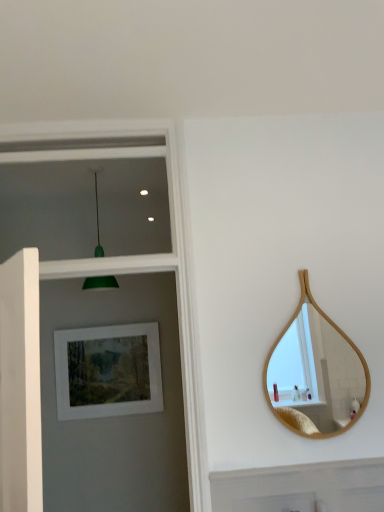
Describe the element at coordinates (108, 371) in the screenshot. I see `matte white picture frame at upper left` at that location.

Find the location of a particular element. This screenshot has height=512, width=384. bamboo mirror at right is located at coordinates (316, 373).

From a real-world perspective, which object stands above the other?

green matte pendant light at upper left, from a real-world perspective.

Is green matte pendant light at upper left not near bamboo mirror at right?

Yes, green matte pendant light at upper left and bamboo mirror at right are quite far apart.

Is green matte pendant light at upper left in front of or behind bamboo mirror at right in the image?

Clearly, green matte pendant light at upper left is behind bamboo mirror at right.

Where is `mirror that appears below the green matte pendant light at upper left (from a real-world perspective)`? The height and width of the screenshot is (512, 384). mirror that appears below the green matte pendant light at upper left (from a real-world perspective) is located at coordinates (316, 373).

Which of these two, matte white picture frame at upper left or green matte pendant light at upper left, is bigger?

green matte pendant light at upper left is bigger.

From a real-world perspective, who is located lower, matte white picture frame at upper left or green matte pendant light at upper left?

matte white picture frame at upper left.

Is matte white picture frame at upper left far away from green matte pendant light at upper left?

No, matte white picture frame at upper left is in close proximity to green matte pendant light at upper left.

You are a GUI agent. You are given a task and a screenshot of the screen. Output one action in this format:
    pyautogui.click(x=<x>, y=<y>)
    Task: Click on the light fixture lying above the matte white picture frame at upper left (from the image's perspective)
    This screenshot has height=512, width=384.
    Given the screenshot: What is the action you would take?
    pyautogui.click(x=100, y=283)

I want to click on picture frame on the right of green matte pendant light at upper left, so click(108, 371).

From a real-world perspective, is green matte pendant light at upper left above or below matte white picture frame at upper left?

green matte pendant light at upper left is situated higher than matte white picture frame at upper left in the real world.

Which of these two, green matte pendant light at upper left or matte white picture frame at upper left, is bigger?

green matte pendant light at upper left.

Which point is more forward, (299, 378) or (146, 379)?

Point (299, 378)

Which of these two, bamboo mirror at right or matte white picture frame at upper left, is smaller?

With smaller size is bamboo mirror at right.

Which is behind, bamboo mirror at right or matte white picture frame at upper left?

matte white picture frame at upper left is further from the camera.

Is bamboo mirror at right taller or shorter than matte white picture frame at upper left?

bamboo mirror at right is taller than matte white picture frame at upper left.

Who is shorter, matte white picture frame at upper left or bamboo mirror at right?

matte white picture frame at upper left.

Which is in front, matte white picture frame at upper left or bamboo mirror at right?

bamboo mirror at right is in front.

Consider the image. Would you say matte white picture frame at upper left is outside bamboo mirror at right?

Yes, matte white picture frame at upper left is outside of bamboo mirror at right.

Does matte white picture frame at upper left have a greater width compared to bamboo mirror at right?

Yes, matte white picture frame at upper left is wider than bamboo mirror at right.

From the image's perspective, is bamboo mirror at right below green matte pendant light at upper left?

Yes, from the image's perspective, bamboo mirror at right is beneath green matte pendant light at upper left.

Does bamboo mirror at right have a greater height compared to green matte pendant light at upper left?

Yes.

Could you tell me if bamboo mirror at right is turned towards green matte pendant light at upper left?

No, bamboo mirror at right is not oriented towards green matte pendant light at upper left.

Which object is positioned more to the right, bamboo mirror at right or green matte pendant light at upper left?

Positioned to the right is bamboo mirror at right.

Identify the location of light fixture on the left of bamboo mirror at right. (100, 283).

Image resolution: width=384 pixels, height=512 pixels. I want to click on picture frame below the green matte pendant light at upper left (from a real-world perspective), so click(x=108, y=371).

Considering their positions, is bamboo mirror at right positioned closer to matte white picture frame at upper left than green matte pendant light at upper left?

green matte pendant light at upper left lies closer to matte white picture frame at upper left than the other object.

Which object lies nearer to the anchor point matte white picture frame at upper left, green matte pendant light at upper left or bamboo mirror at right?

green matte pendant light at upper left is positioned closer to the anchor matte white picture frame at upper left.

Looking at the image, which one is located closer to bamboo mirror at right, matte white picture frame at upper left or green matte pendant light at upper left?

Among the two, matte white picture frame at upper left is located nearer to bamboo mirror at right.

When comparing their distances from green matte pendant light at upper left, does bamboo mirror at right or matte white picture frame at upper left seem further?

bamboo mirror at right.

From the image, which object appears to be farther from green matte pendant light at upper left, matte white picture frame at upper left or bamboo mirror at right?

bamboo mirror at right.

Estimate the real-world distances between objects in this image. Which object is closer to bamboo mirror at right, green matte pendant light at upper left or matte white picture frame at upper left?

matte white picture frame at upper left.

Where is `picture frame between green matte pendant light at upper left and bamboo mirror at right in the horizontal direction`? The width and height of the screenshot is (384, 512). picture frame between green matte pendant light at upper left and bamboo mirror at right in the horizontal direction is located at coordinates (108, 371).